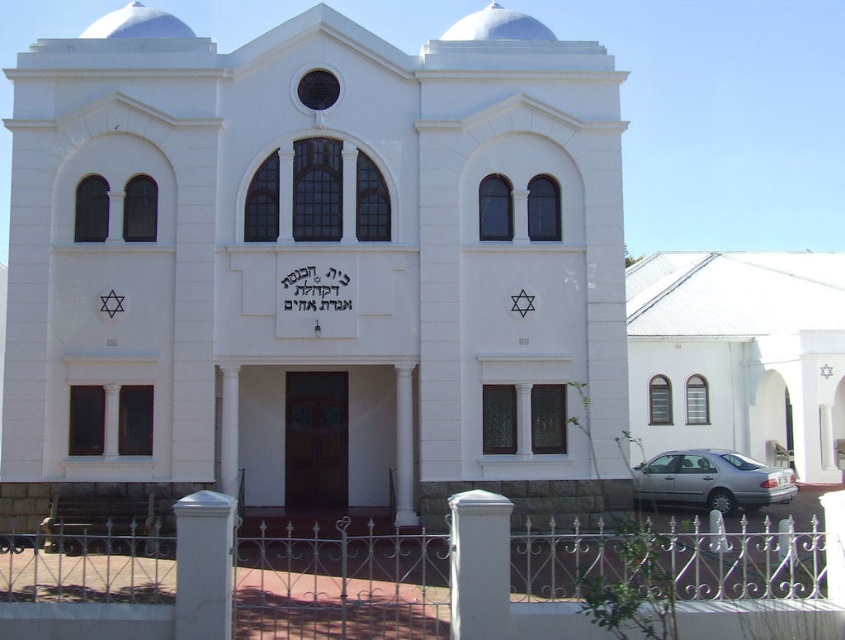
Who is positioned more to the right, white wrought iron fence at center or silver metallic car at lower right?

Positioned to the right is silver metallic car at lower right.

Who is more forward, (x=729, y=557) or (x=747, y=508)?

Positioned in front is point (x=729, y=557).

The width and height of the screenshot is (845, 640). I want to click on white wrought iron fence at center, so click(416, 579).

Which of these two, white stone church at center or white smooth chapel at lower right, stands shorter?

With less height is white smooth chapel at lower right.

Between point (31, 193) and point (644, 264), which one is positioned behind?

The point (644, 264) is more distant.

Find the location of `white stone church at center`. white stone church at center is located at coordinates (313, 260).

Is white smooth chapel at lower right to the left of silver metallic car at lower right from the viewer's perspective?

No, white smooth chapel at lower right is not to the left of silver metallic car at lower right.

Which is in front, point (721, 330) or point (792, 486)?

Point (792, 486)

Identify the location of white smooth chapel at lower right. This screenshot has width=845, height=640. (739, 355).